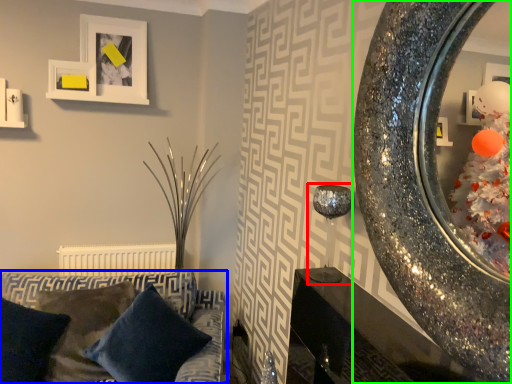
Question: Estimate the real-world distances between objects in this image. Which object is farther from candle holder (highlighted by a red box), studio couch (highlighted by a blue box) or mirror (highlighted by a green box)?

Choices:
 (A) studio couch
 (B) mirror

Answer: (A)